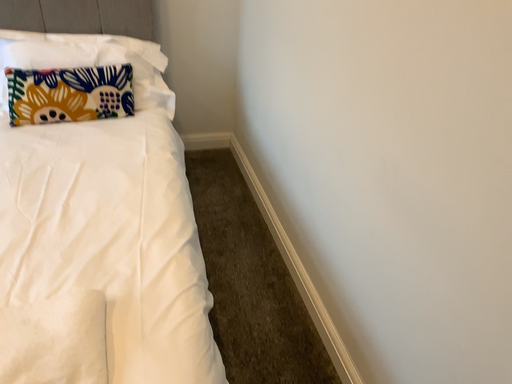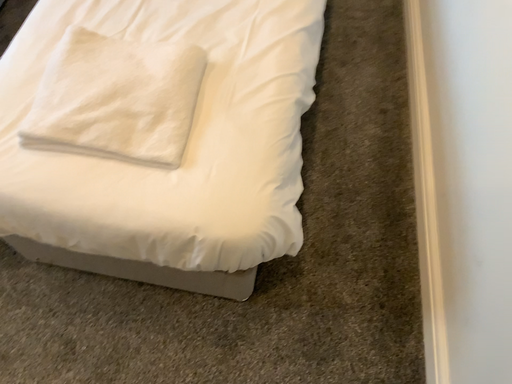
Question: Which way did the camera rotate in the video?

Choices:
 (A) rotated right
 (B) rotated left

Answer: (B)